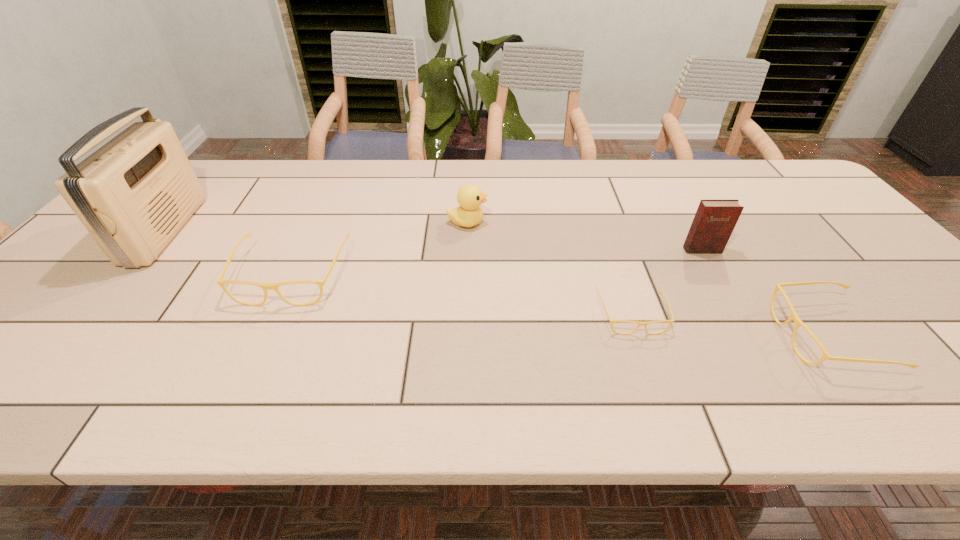
Locate an element on the screen. the fourth object from right to left is located at coordinates (470, 197).

I want to click on vacant space located in front of the lenses of the second object from left to right, so click(x=257, y=353).

At what (x,y) coordinates should I click in order to perform the action: click on vacant space situated in front of the lenses of the rightmost spectacles. Please return your answer as a coordinate pair (x, y). This screenshot has width=960, height=540. Looking at the image, I should click on (682, 336).

What are the coordinates of `vacant space located 0.240m in front of the lenses of the rightmost spectacles` in the screenshot? It's located at [672, 336].

Locate an element on the screen. The width and height of the screenshot is (960, 540). blank area located 0.340m in front of the lenses of the rightmost spectacles is located at coordinates (626, 336).

Where is `free space located 0.070m on the front-facing side of the radio receiver`? Image resolution: width=960 pixels, height=540 pixels. free space located 0.070m on the front-facing side of the radio receiver is located at coordinates (210, 231).

This screenshot has width=960, height=540. Identify the location of vacant space located 0.120m on the front cover of the fifth object from left to right. (722, 286).

Locate an element on the screen. This screenshot has height=540, width=960. free space located on the face of the fourth shortest object is located at coordinates (533, 222).

Where is `object present at the far edge`? object present at the far edge is located at coordinates (133, 194).

You are a GUI agent. You are given a task and a screenshot of the screen. Output one action in this format:
    pyautogui.click(x=<x>, y=<y>)
    Task: Click on the object that is positioned at the left edge
    
    Given the screenshot: What is the action you would take?
    coord(133,194)